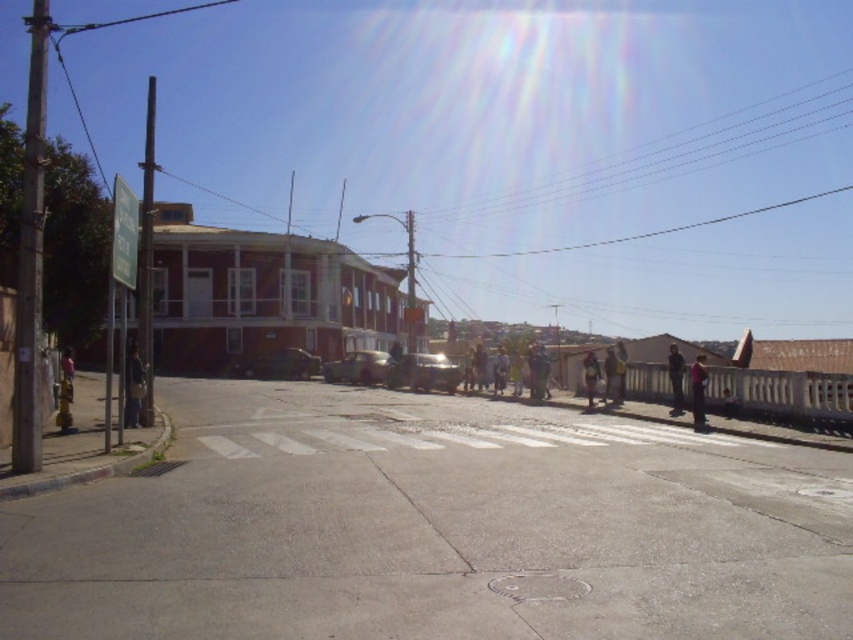
Can you confirm if dark blue jeans at center is thinner than brown leather jacket at center?

Incorrect, dark blue jeans at center's width is not less than brown leather jacket at center's.

Who is positioned more to the left, dark blue jeans at center or brown leather jacket at center?

brown leather jacket at center

Describe the element at coordinates (698, 392) in the screenshot. I see `dark blue jeans at center` at that location.

Identify the location of dark blue jeans at center. Image resolution: width=853 pixels, height=640 pixels. (698, 392).

Can you confirm if metallic silver train at center is positioned to the left of brown leather jacket at center?

Yes, metallic silver train at center is to the left of brown leather jacket at center.

Is point (431, 371) more distant than point (614, 381)?

Yes, point (431, 371) is behind point (614, 381).

Locate an element on the screen. metallic silver train at center is located at coordinates (422, 372).

Can you confirm if matte black jacket at left is taller than brown leather jacket at center?

Yes.

Between matte black jacket at left and brown leather jacket at center, which one appears on the left side from the viewer's perspective?

From the viewer's perspective, matte black jacket at left appears more on the left side.

Is point (136, 387) closer to camera compared to point (612, 365)?

Yes, point (136, 387) is in front of point (612, 365).

Find the location of a particular element. matte black jacket at left is located at coordinates (132, 385).